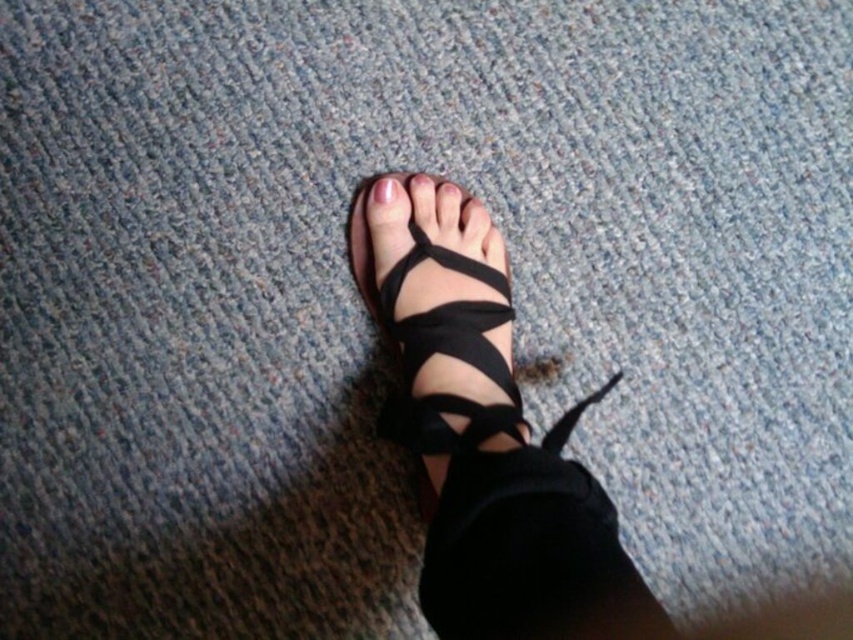
You are designing a virtual reality environment and need to place an object at the exact center of the scene. The scene has a coordinate system where the bottom left corner is at point 0,0 and the top right corner is at point 1,1. You see the black leather sandals at center. Where should you place the object to ensure it is exactly at the center of the scene?

The black leather sandals at center are located at point [485,440], which is not the exact center of the scene. The exact center would be at point [426,320]. Therefore, you should place the object at point [426,320] to ensure it is exactly at the center of the scene.

You are a designer creating a new sandal style and want to ensure the straps don not cover the nails. Based on the image, is the black leather strap at lower center positioned above or below the pink matte nail at center?

The black leather strap at lower center is below the pink matte nail at center, so it does not cover the nails.

From the picture: You are a photographer setting up a shoot focusing on the foot and sandals. You need to ensure the pink matte nail at center and black leather sandals at center are both visible in the frame. Given their positions, which object should you adjust to keep both in focus?

The black leather sandals at center is located below the pink matte nail at center. To keep both in focus, adjust the black leather sandals at center to move them closer to the same plane as the pink matte nail at center.